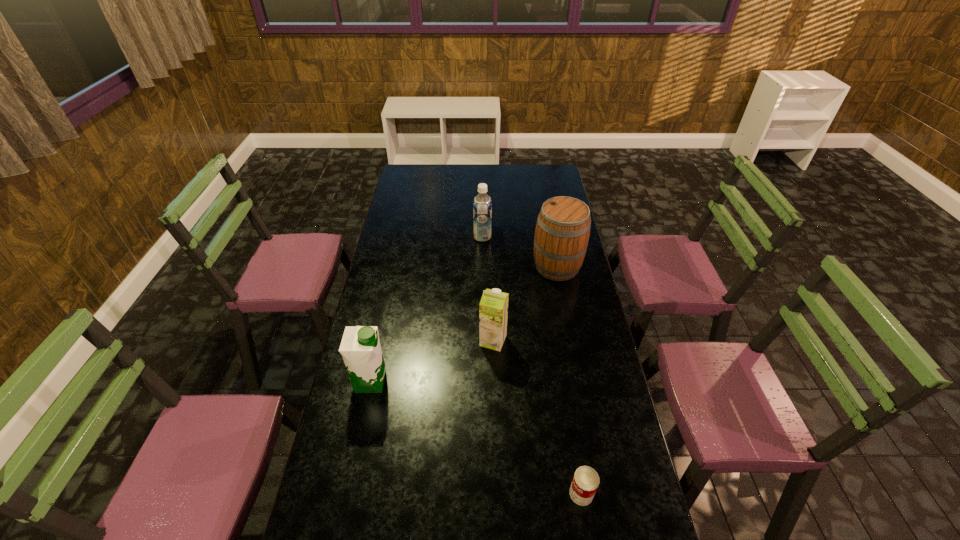
Find the location of a particular element. blank space located on the label of the farthest soya milk is located at coordinates click(423, 237).

This screenshot has width=960, height=540. Find the location of `vacant area situated 0.380m on the front-facing side of the leftmost soya milk`. vacant area situated 0.380m on the front-facing side of the leftmost soya milk is located at coordinates coord(499,382).

Find the location of a particular element. This screenshot has width=960, height=540. vacant area situated on the right of the second nearest soya milk is located at coordinates (566, 341).

Where is `vacant space positioned on the front label of the can`? The width and height of the screenshot is (960, 540). vacant space positioned on the front label of the can is located at coordinates (459, 494).

Where is `vacant area situated on the front label of the can`? vacant area situated on the front label of the can is located at coordinates (480, 494).

Identify the location of vacant region located on the front label of the can. The height and width of the screenshot is (540, 960). (540, 494).

I want to click on object situated at the left edge, so [x=360, y=347].

Locate an element on the screen. The width and height of the screenshot is (960, 540). cider present at the right edge is located at coordinates (562, 231).

Find the location of a particular element. can present at the right edge is located at coordinates (585, 482).

The height and width of the screenshot is (540, 960). In the image, there is a desktop. What are the coordinates of `vacant space at the far edge` in the screenshot? It's located at (497, 170).